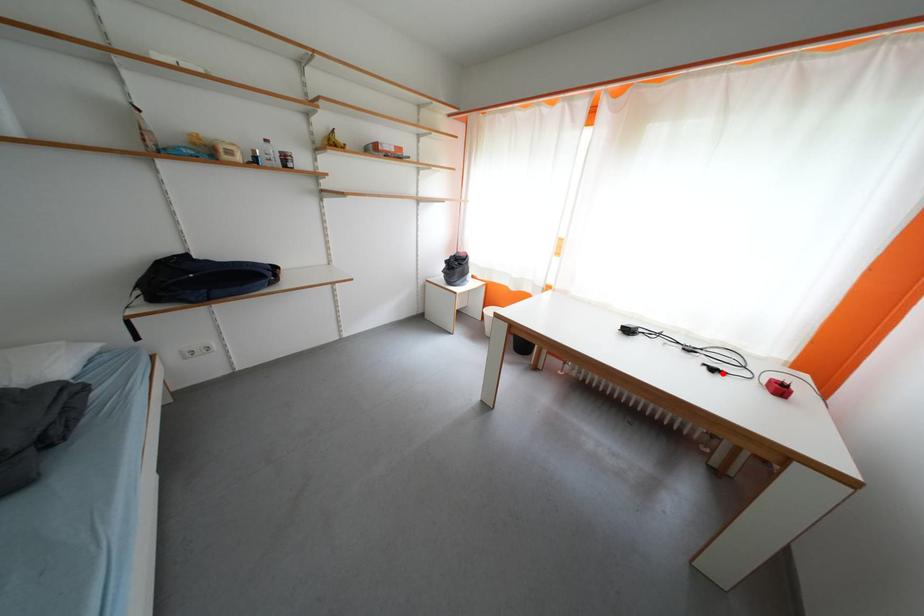
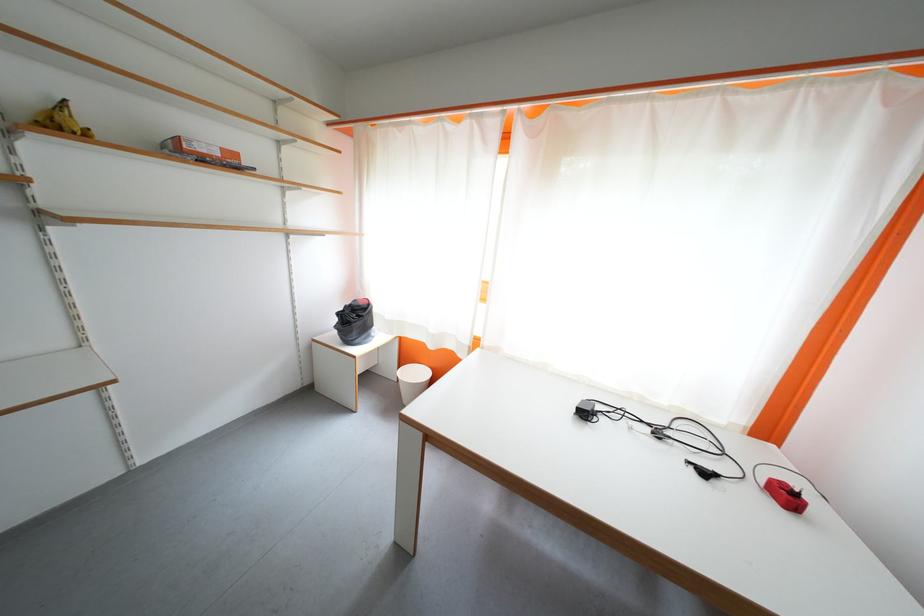
Where in the second image is the point corresponding to the highlighted location from the first image?

(713, 477)